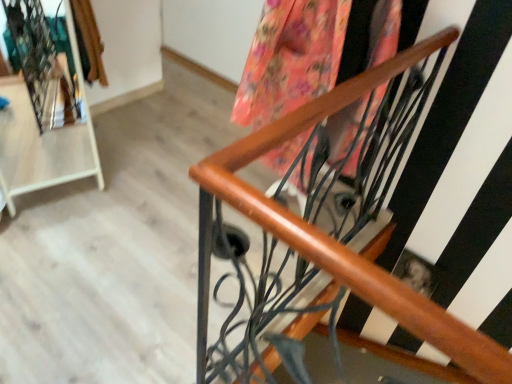
Where is `metal mirror at upper left`? The height and width of the screenshot is (384, 512). metal mirror at upper left is located at coordinates (44, 141).

What do you see at coordinates (44, 141) in the screenshot? I see `metal mirror at upper left` at bounding box center [44, 141].

At what (x,y) coordinates should I click in order to perform the action: click on metal mirror at upper left. Please return your answer as a coordinate pair (x, y). This screenshot has width=512, height=384. Looking at the image, I should click on (44, 141).